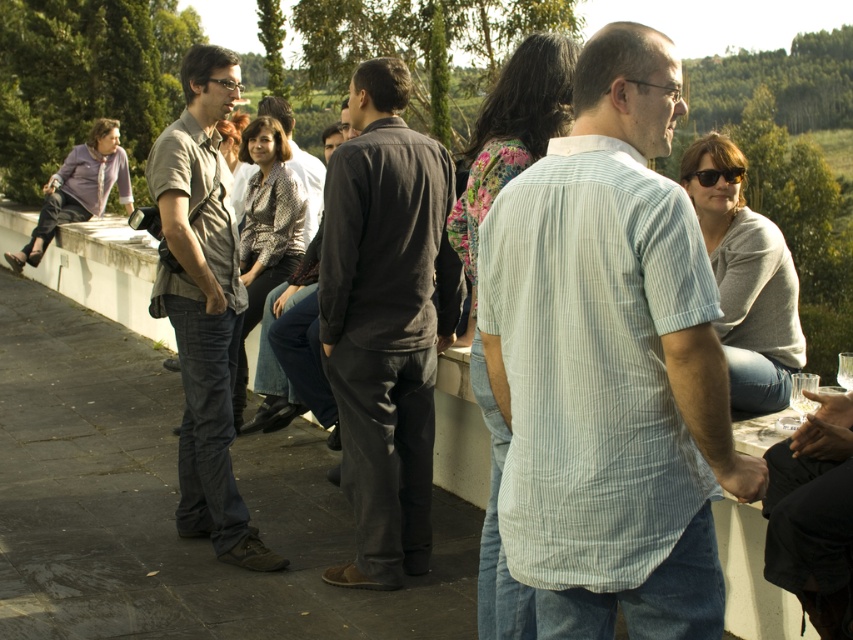
You are organizing a group photo and need to arrange two individuals wearing the dark gray cotton shirt at center and the metallic textured jacket at center. Which person should stand in front to ensure both are visible in the photo?

The person wearing the dark gray cotton shirt at center should stand in front because it has a smaller size compared to the metallic textured jacket at center, allowing both to be visible without overlapping.

Consider the image. You are a photographer trying to capture a group photo of the dark gray cotton shirt at center and the metallic textured jacket at center. The camera you are using has a minimum focus distance of 1.5 meters. Can you take a clear photo of both subjects without moving them?

The dark gray cotton shirt at center is 2.04 meters from the metallic textured jacket at center. Since the camera requires a minimum focus distance of 1.5 meters, the photographer can take a clear photo of both subjects without moving them because the distance between them is greater than the camera requirement.

You are standing at the origin point of the image. Where is the dark gray cotton shirt at center located in relation to you?

The dark gray cotton shirt at center is located at point (386, 321) relative to the origin point.